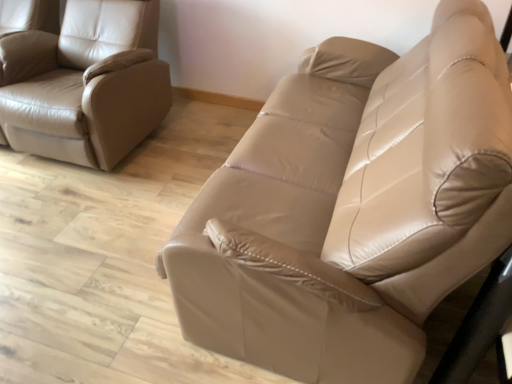
Describe the element at coordinates (353, 207) in the screenshot. I see `matte leather couch at center` at that location.

Locate an element on the screen. matte leather couch at center is located at coordinates (353, 207).

Find the location of a particular element. This screenshot has width=512, height=384. matte leather chair at left is located at coordinates (85, 83).

Describe the element at coordinates (85, 83) in the screenshot. Image resolution: width=512 pixels, height=384 pixels. I see `matte leather chair at left` at that location.

Find the location of `matte leather couch at center`. matte leather couch at center is located at coordinates (353, 207).

Can you confirm if matte leather couch at center is positioned to the right of matte leather chair at left?

Indeed, matte leather couch at center is positioned on the right side of matte leather chair at left.

Is the position of matte leather couch at center less distant than that of matte leather chair at left?

Yes.

Is point (421, 310) positioned behind point (28, 139)?

No, (421, 310) is closer to viewer.

From the image's perspective, does matte leather couch at center appear higher than matte leather chair at left?

Incorrect, from the image's perspective, matte leather couch at center is lower than matte leather chair at left.

From a real-world perspective, does matte leather couch at center stand above matte leather chair at left?

Yes, from a real-world perspective, matte leather couch at center is over matte leather chair at left

Does matte leather couch at center have a greater width compared to matte leather chair at left?

Yes.

Is matte leather couch at center taller than matte leather chair at left?

Yes, matte leather couch at center is taller than matte leather chair at left.

Considering the sizes of matte leather couch at center and matte leather chair at left in the image, is matte leather couch at center bigger or smaller than matte leather chair at left?

Clearly, matte leather couch at center is larger in size than matte leather chair at left.

Would you say matte leather couch at center is outside matte leather chair at left?

Yes.

Is matte leather couch at center positioned far away from matte leather chair at left?

Yes, matte leather couch at center and matte leather chair at left are located far from each other.

Is matte leather couch at center facing towards matte leather chair at left?

Yes, matte leather couch at center is turned towards matte leather chair at left.

Can you tell me how much matte leather couch at center and matte leather chair at left differ in facing direction?

The facing directions of matte leather couch at center and matte leather chair at left are 91.4 degrees apart.

How much distance is there between matte leather couch at center and matte leather chair at left?

matte leather couch at center is 3.83 feet away from matte leather chair at left.

Find the location of `chair that appears above the matte leather couch at center (from the image's perspective)`. chair that appears above the matte leather couch at center (from the image's perspective) is located at coordinates (85, 83).

Between matte leather chair at left and matte leather couch at center, which one appears on the right side from the viewer's perspective?

matte leather couch at center is more to the right.

Is matte leather chair at left further to the viewer compared to matte leather couch at center?

Yes, matte leather chair at left is behind matte leather couch at center.

Does point (132, 110) lie in front of point (384, 144)?

No.

From the image's perspective, would you say matte leather chair at left is shown under matte leather couch at center?

No, from the image's perspective, matte leather chair at left is not below matte leather couch at center.

From a real-world perspective, does matte leather chair at left sit lower than matte leather couch at center?

Yes, from a real-world perspective, matte leather chair at left is below matte leather couch at center.

Does matte leather chair at left have a greater width compared to matte leather couch at center?

No, matte leather chair at left is not wider than matte leather couch at center.

Is matte leather chair at left shorter than matte leather couch at center?

Correct, matte leather chair at left is not as tall as matte leather couch at center.

Between matte leather chair at left and matte leather couch at center, which one has larger size?

matte leather couch at center is bigger.

Is matte leather chair at left spatially inside matte leather couch at center, or outside of it?

matte leather chair at left is not enclosed by matte leather couch at center.

Is there a large distance between matte leather chair at left and matte leather couch at center?

Yes.

Is matte leather chair at left turned away from matte leather couch at center?

A: That's not correct — matte leather chair at left is not looking away from matte leather couch at center.

Find the location of a particular element. chair on the left side of matte leather couch at center is located at coordinates (85, 83).

Identify the location of studio couch that appears in front of the matte leather chair at left. The width and height of the screenshot is (512, 384). 353,207.

You are a GUI agent. You are given a task and a screenshot of the screen. Output one action in this format:
    pyautogui.click(x=<x>, y=<y>)
    Task: Click on the chair beneath the matte leather couch at center (from a real-world perspective)
    
    Given the screenshot: What is the action you would take?
    pyautogui.click(x=85, y=83)